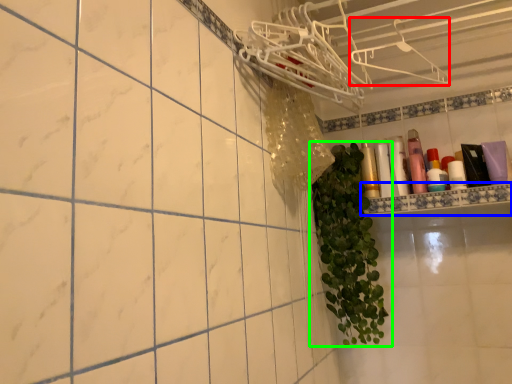
Question: Which object is the farthest from hanger (highlighted by a red box)? Choose among these: ledge (highlighted by a blue box) or houseplant (highlighted by a green box).

Choices:
 (A) ledge
 (B) houseplant

Answer: (B)